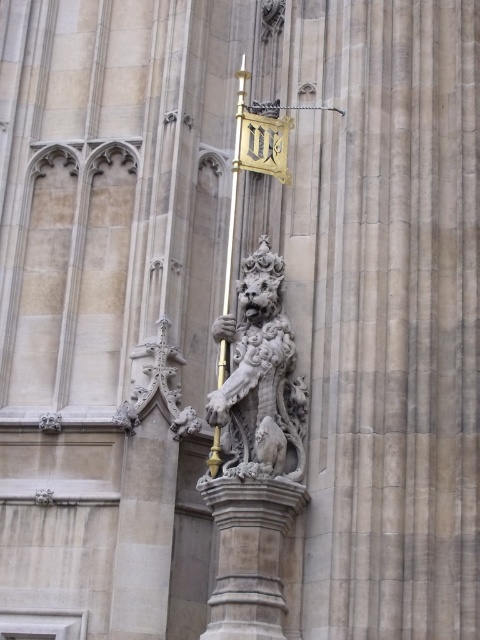
Who is more distant from viewer, [261,600] or [278,179]?

The point [278,179] is more distant.

Measure the distance between point (250, 568) and camera.

A distance of 51.11 meters exists between point (250, 568) and camera.

You are a GUI agent. You are given a task and a screenshot of the screen. Output one action in this format:
    pyautogui.click(x=<x>, y=<y>)
    Task: Click on the carved stone lion at center
    This screenshot has width=480, height=640.
    Given the screenshot: What is the action you would take?
    pyautogui.click(x=250, y=554)

Can you confirm if carved stone lion at center is positioned to the left of gold polished metal pole at center?

In fact, carved stone lion at center is to the right of gold polished metal pole at center.

Is point (229, 628) behind point (226, 276)?

No, it is not.

At what (x,y) coordinates should I click in order to perform the action: click on carved stone lion at center. Please return your answer as a coordinate pair (x, y). This screenshot has height=640, width=480. Looking at the image, I should click on (250, 554).

Who is lower down, white stone lion at center or gold polished metal pole at center?

white stone lion at center is below.

Is point (248, 289) behind point (240, 108)?

That is False.

Is point (287, 364) behind point (228, 272)?

No, (287, 364) is closer to viewer.

Find the location of a particular element. This screenshot has height=640, width=480. white stone lion at center is located at coordinates (260, 378).